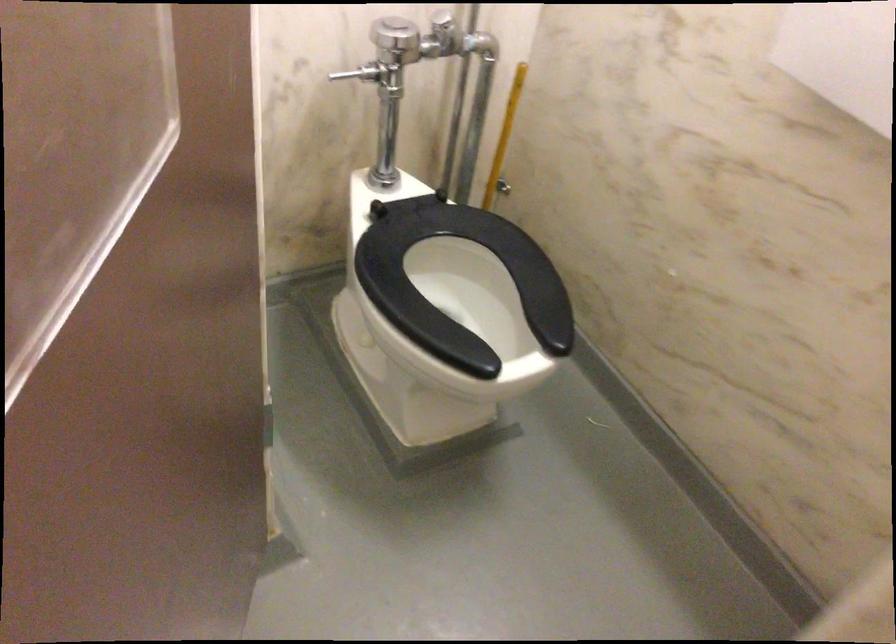
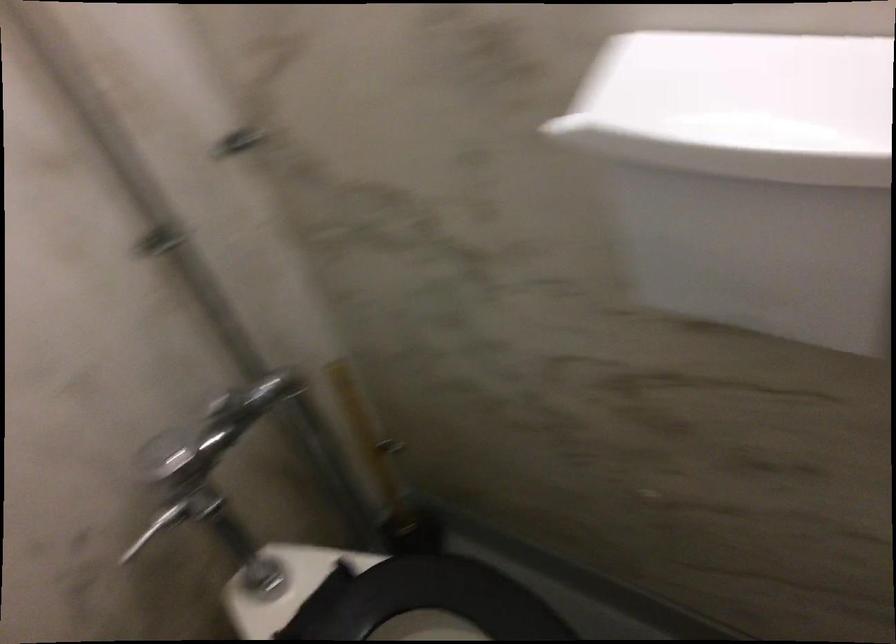
Question: The camera is either moving clockwise (left) or counter-clockwise (right) around the object. The first image is from the beginning of the video and the second image is from the end. Is the camera moving left or right when shooting the video?

Choices:
 (A) Left
 (B) Right

Answer: (A)